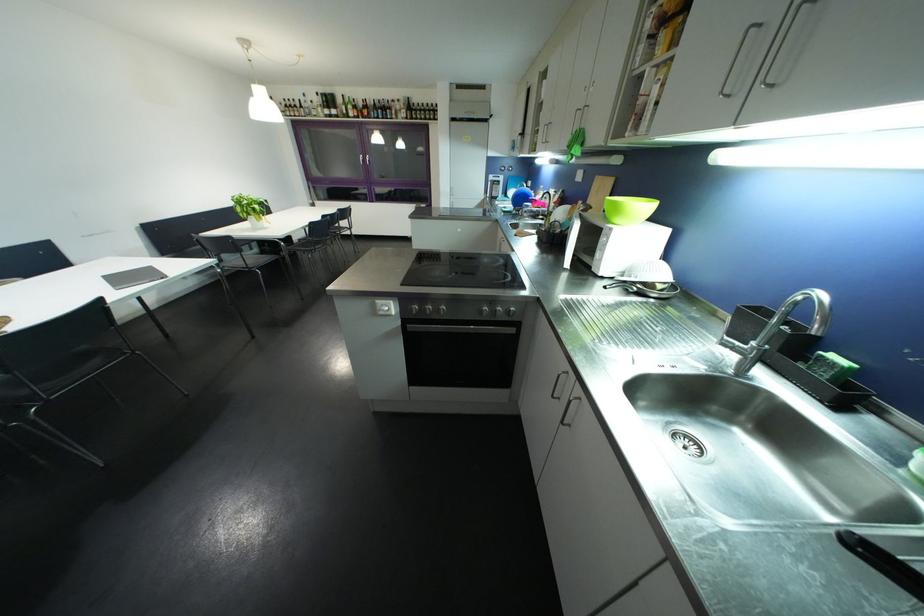
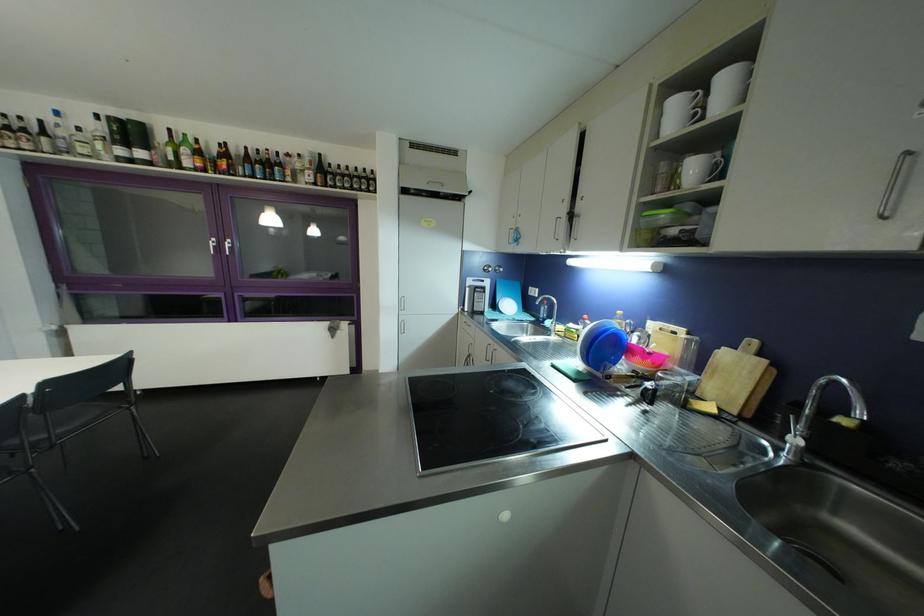
In the second image, find the point that corresponds to (351,106) in the first image.

(180, 146)